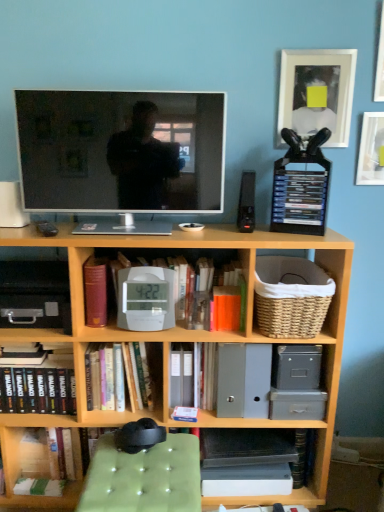
Question: Would you consider wooden bookcase at center to be distant from woven straw basket at right?

Choices:
 (A) no
 (B) yes

Answer: (A)

Question: Considering the relative positions of wooden bookcase at center and woven straw basket at right in the image provided, is wooden bookcase at center to the right of woven straw basket at right from the viewer's perspective?

Choices:
 (A) no
 (B) yes

Answer: (A)

Question: Does wooden bookcase at center lie behind woven straw basket at right?

Choices:
 (A) no
 (B) yes

Answer: (A)

Question: Is woven straw basket at right completely or partially inside wooden bookcase at center?

Choices:
 (A) no
 (B) yes

Answer: (B)

Question: Is wooden bookcase at center facing towards woven straw basket at right?

Choices:
 (A) yes
 (B) no

Answer: (A)

Question: From the image's perspective, is wooden bookcase at center located beneath woven straw basket at right?

Choices:
 (A) no
 (B) yes

Answer: (B)

Question: Does white plastic clock at center, marked as the 1th book in a right-to-left arrangement, lie in front of matte black tv at center?

Choices:
 (A) no
 (B) yes

Answer: (A)

Question: Is matte black tv at center inside white plastic clock at center, marked as the 1th book in a right-to-left arrangement?

Choices:
 (A) no
 (B) yes

Answer: (A)

Question: From the image's perspective, is white plastic clock at center, marked as the 1th book in a right-to-left arrangement, under matte black tv at center?

Choices:
 (A) yes
 (B) no

Answer: (A)

Question: Is white plastic clock at center, marked as the 1th book in a right-to-left arrangement, shorter than matte black tv at center?

Choices:
 (A) no
 (B) yes

Answer: (B)

Question: Does white plastic clock at center, marked as the 1th book in a right-to-left arrangement, have a greater height compared to matte black tv at center?

Choices:
 (A) no
 (B) yes

Answer: (A)

Question: From a real-world perspective, does white plastic clock at center, marked as the 1th book in a right-to-left arrangement, stand above matte black tv at center?

Choices:
 (A) yes
 (B) no

Answer: (B)

Question: From a real-world perspective, is orange matte paperback book at center, which is counted as the second paperback book, starting from the left, located higher than white plastic alarm clock at center?

Choices:
 (A) no
 (B) yes

Answer: (A)